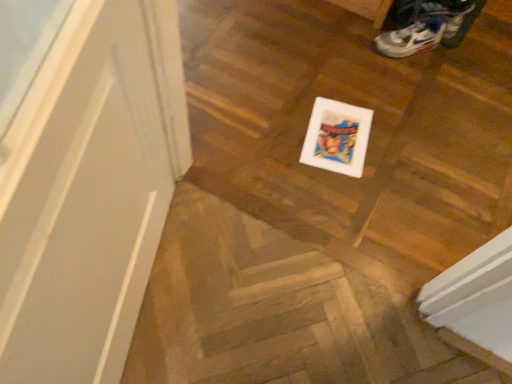
Question: Is white mesh shoe at upper right smaller than wooden floor at center?

Choices:
 (A) no
 (B) yes

Answer: (B)

Question: Is there a large distance between white mesh shoe at upper right and wooden floor at center?

Choices:
 (A) yes
 (B) no

Answer: (A)

Question: Considering the relative sizes of white mesh shoe at upper right and wooden floor at center in the image provided, is white mesh shoe at upper right wider than wooden floor at center?

Choices:
 (A) yes
 (B) no

Answer: (B)

Question: Is white mesh shoe at upper right to the left of wooden floor at center from the viewer's perspective?

Choices:
 (A) no
 (B) yes

Answer: (A)

Question: Is white mesh shoe at upper right located outside wooden floor at center?

Choices:
 (A) yes
 (B) no

Answer: (A)

Question: Is white mesh shoe at upper right taller than wooden floor at center?

Choices:
 (A) no
 (B) yes

Answer: (B)

Question: From the image's perspective, is wooden floor at center located beneath white mesh shoe at upper right?

Choices:
 (A) yes
 (B) no

Answer: (A)

Question: Can you confirm if wooden floor at center is smaller than white mesh shoe at upper right?

Choices:
 (A) no
 (B) yes

Answer: (A)

Question: Is wooden floor at center in contact with white mesh shoe at upper right?

Choices:
 (A) yes
 (B) no

Answer: (B)

Question: Is wooden floor at center facing away from white mesh shoe at upper right?

Choices:
 (A) yes
 (B) no

Answer: (B)

Question: From the image's perspective, does wooden floor at center appear higher than white mesh shoe at upper right?

Choices:
 (A) yes
 (B) no

Answer: (B)

Question: Is wooden floor at center behind white mesh shoe at upper right?

Choices:
 (A) no
 (B) yes

Answer: (A)

Question: Based on their sizes in the image, would you say white mesh shoe at upper right is bigger or smaller than wooden floor at center?

Choices:
 (A) big
 (B) small

Answer: (B)